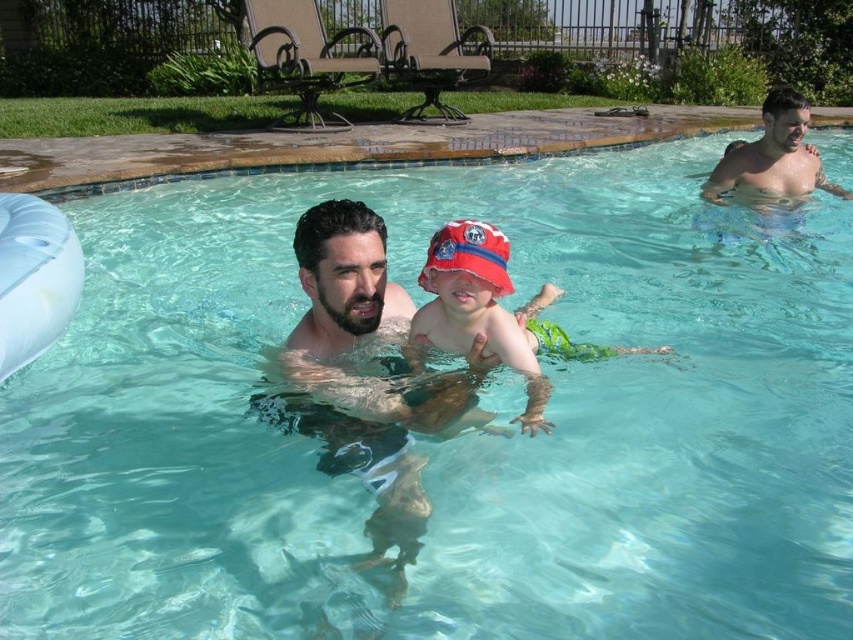
Question: Which of the following is the farthest from the observer?

Choices:
 (A) (811, 156)
 (B) (471, 317)

Answer: (A)

Question: Where is red fabric bucket hat at center located in relation to smooth skin man at upper right in the image?

Choices:
 (A) above
 (B) below

Answer: (B)

Question: Where is red fabric bucket hat at center located in relation to smooth skin man at upper right in the image?

Choices:
 (A) left
 (B) right

Answer: (A)

Question: Which point appears closest to the camera in this image?

Choices:
 (A) [532, 376]
 (B) [790, 180]

Answer: (A)

Question: Can you confirm if red fabric bucket hat at center is positioned to the left of smooth skin man at upper right?

Choices:
 (A) yes
 (B) no

Answer: (A)